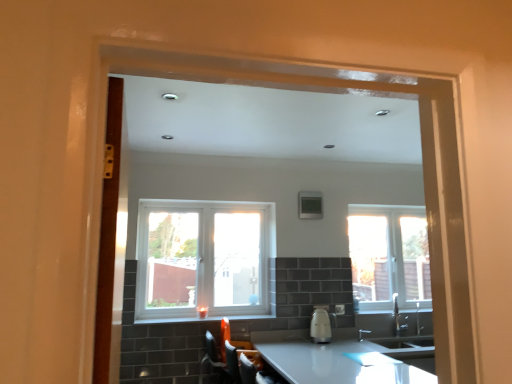
Image resolution: width=512 pixels, height=384 pixels. What are the coordinates of `free point above white glossy countertop at lower center (from a real-world perspective)` in the screenshot? It's located at (336, 361).